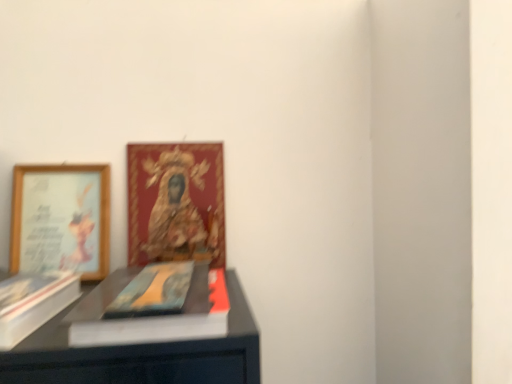
Question: Is the depth of matte blue book at center less than that of white matte paperback book at left?

Choices:
 (A) no
 (B) yes

Answer: (A)

Question: Is matte blue book at center facing away from white matte paperback book at left?

Choices:
 (A) no
 (B) yes

Answer: (A)

Question: Is matte blue book at center with white matte paperback book at left?

Choices:
 (A) yes
 (B) no

Answer: (B)

Question: Does matte blue book at center turn towards white matte paperback book at left?

Choices:
 (A) yes
 (B) no

Answer: (B)

Question: Does matte blue book at center appear on the right side of white matte paperback book at left?

Choices:
 (A) no
 (B) yes

Answer: (B)

Question: Considering their positions, is white matte paperback book at left located in front of or behind matte blue book at center?

Choices:
 (A) behind
 (B) front

Answer: (B)

Question: Visually, is white matte paperback book at left positioned to the left or to the right of matte blue book at center?

Choices:
 (A) right
 (B) left

Answer: (B)

Question: Is white matte paperback book at left inside the boundaries of matte blue book at center, or outside?

Choices:
 (A) outside
 (B) inside

Answer: (A)

Question: From their relative heights in the image, would you say white matte paperback book at left is taller or shorter than matte blue book at center?

Choices:
 (A) tall
 (B) short

Answer: (A)

Question: Is gold-framed picture at upper left, which appears as the first picture frame when viewed from the right, inside the boundaries of white matte paperback book at left, or outside?

Choices:
 (A) outside
 (B) inside

Answer: (A)

Question: In terms of width, does gold-framed picture at upper left, which is the 2th picture frame from left to right, look wider or thinner when compared to white matte paperback book at left?

Choices:
 (A) thin
 (B) wide

Answer: (A)

Question: Visually, is gold-framed picture at upper left, which is the 2th picture frame from left to right, positioned to the left or to the right of white matte paperback book at left?

Choices:
 (A) left
 (B) right

Answer: (B)

Question: Is gold-framed picture at upper left, which is the 2th picture frame from left to right, in front of or behind white matte paperback book at left in the image?

Choices:
 (A) front
 (B) behind

Answer: (B)

Question: Considering the positions of wooden framed picture at left, the first picture frame viewed from the left, and matte blue book at center in the image, is wooden framed picture at left, the first picture frame viewed from the left, bigger or smaller than matte blue book at center?

Choices:
 (A) big
 (B) small

Answer: (A)

Question: In the image, is wooden framed picture at left, the first picture frame viewed from the left, positioned in front of or behind matte blue book at center?

Choices:
 (A) front
 (B) behind

Answer: (B)